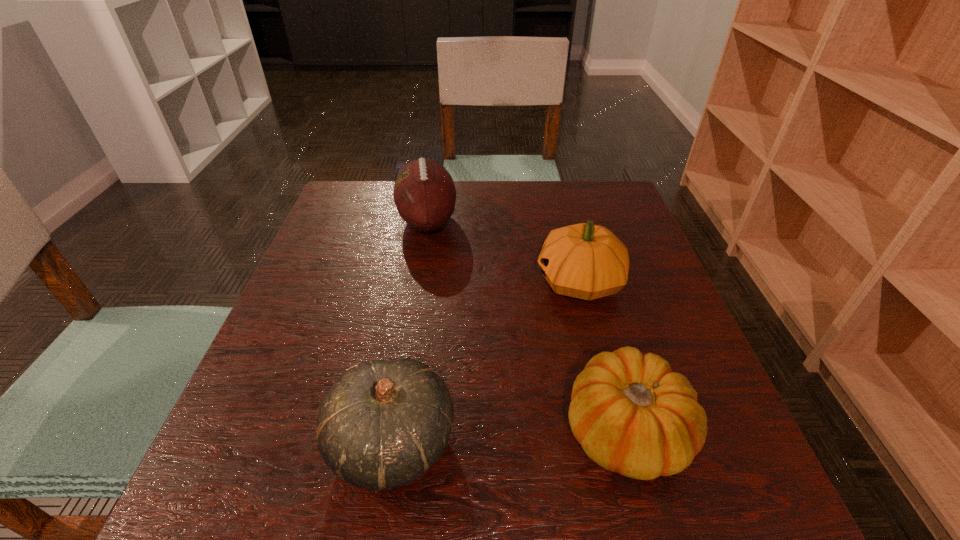
You are a GUI agent. You are given a task and a screenshot of the screen. Output one action in this format:
    pyautogui.click(x=<x>, y=<y>)
    Task: Click on the object that is at the far edge
    
    Given the screenshot: What is the action you would take?
    pyautogui.click(x=424, y=192)

At what (x,y) coordinates should I click in order to perform the action: click on object present at the near right corner. Please return your answer as a coordinate pair (x, y). The height and width of the screenshot is (540, 960). Looking at the image, I should click on (633, 415).

Locate an element on the screen. The image size is (960, 540). vacant space at the far edge is located at coordinates (461, 187).

Image resolution: width=960 pixels, height=540 pixels. In the image, there is a desktop. Find the location of `vacant region at the near edge`. vacant region at the near edge is located at coordinates (339, 498).

The height and width of the screenshot is (540, 960). Identify the location of vacant space at the left edge. (293, 458).

This screenshot has width=960, height=540. In order to click on free space at the right edge of the desktop in this screenshot , I will do `click(608, 312)`.

I want to click on free space at the far left corner of the desktop, so click(362, 208).

The width and height of the screenshot is (960, 540). In the image, there is a desktop. Find the location of `vacant area at the far right corner`. vacant area at the far right corner is located at coordinates (637, 222).

Locate an element on the screen. free space at the near right corner of the desktop is located at coordinates (760, 480).

Find the location of a particular element. The height and width of the screenshot is (540, 960). vacant area between the farthest object and the farthest gourd is located at coordinates (503, 251).